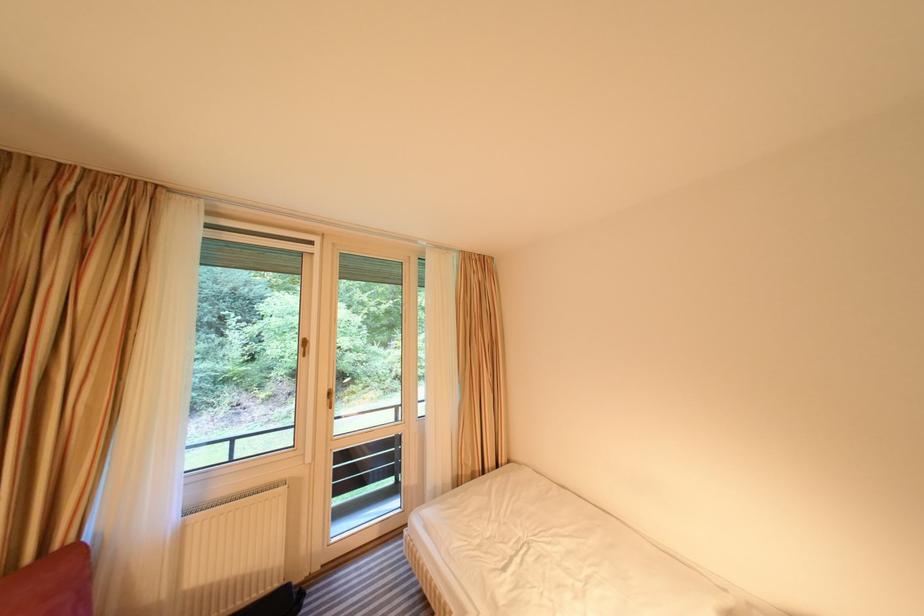
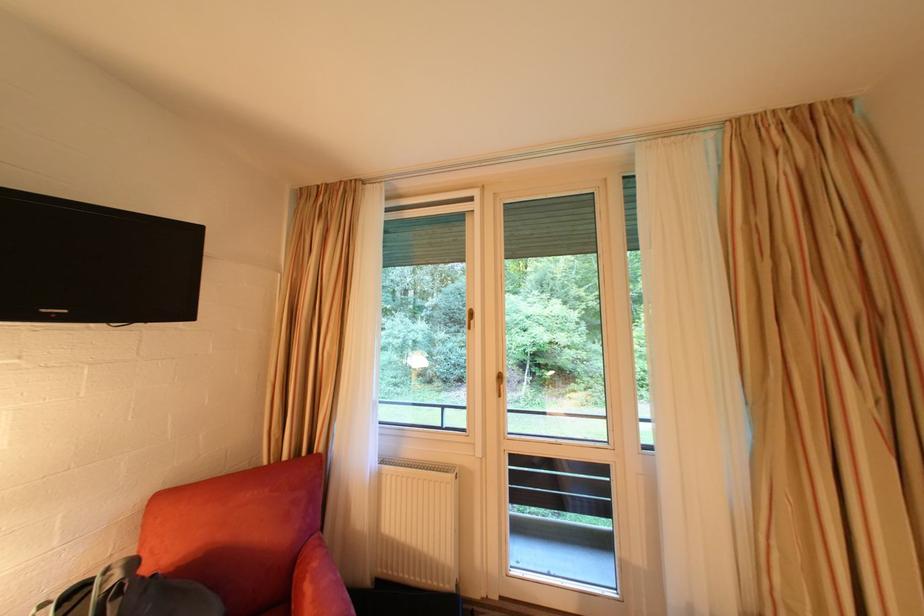
Question: Based on the continuous images, in which direction is the camera rotating? Reply with the corresponding letter.

Choices:
 (A) Left
 (B) Right
 (C) Up
 (D) Down

Answer: (A)